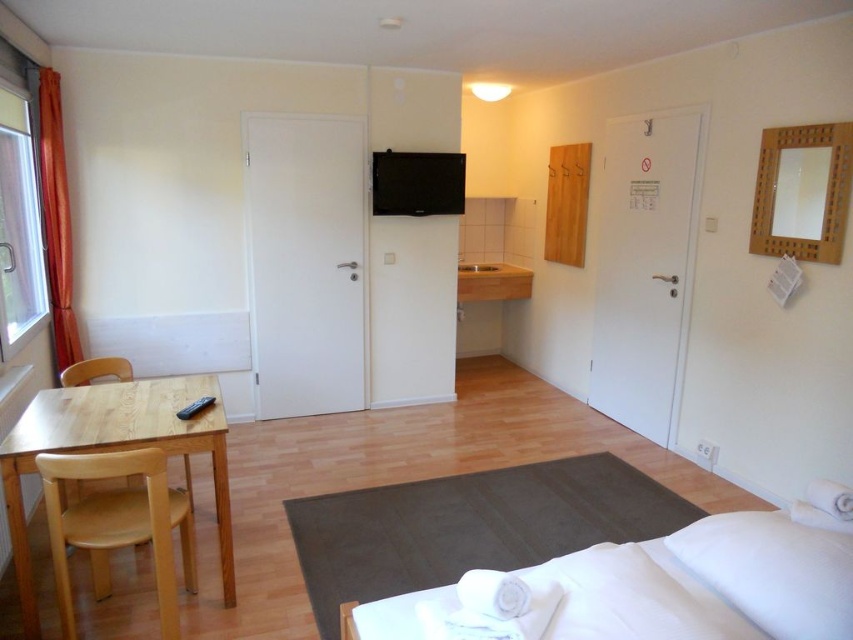
In the scene shown: You are a cleaning robot with a width of 1 meter. You are positioned near the entrance of the room and want to move from the dark gray carpet at lower right to the white soft pillow at lower right. Is there enough space for you to navigate between these two objects?

The distance between the dark gray carpet at lower right and the white soft pillow at lower right is 1.30 meters. Since the robot is 1 meter wide, there is sufficient space for it to navigate between them as the distance is greater than the robot width.

You are moving a light brown wooden chair at left to the dark gray carpet at lower right. Will the chair fit on the carpet?

The dark gray carpet at lower right might be wider than light brown wooden chair at left, so the chair could fit on the carpet. However, there is uncertainty because the description only states that the carpet might be wider, not definitively wider. Therefore, it is possible but not guaranteed.